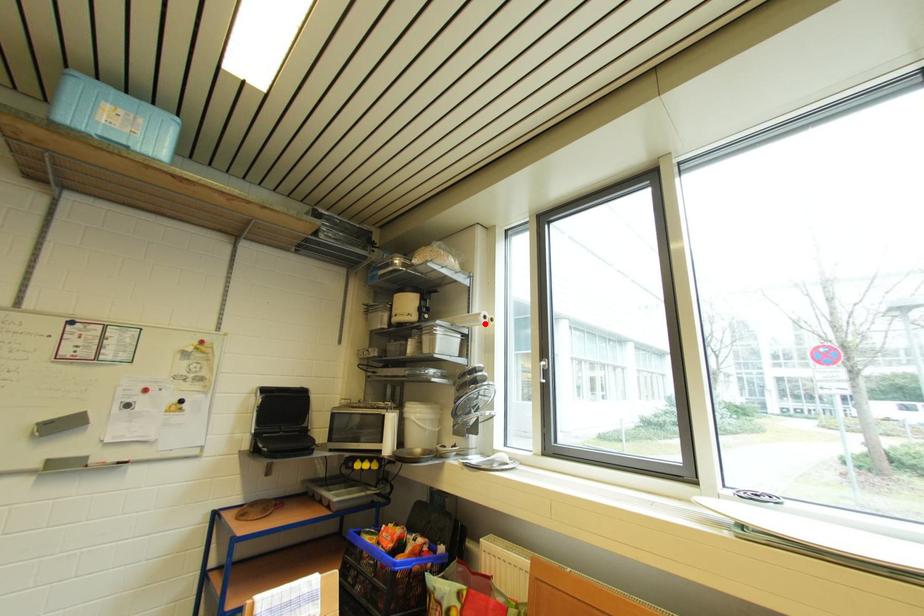
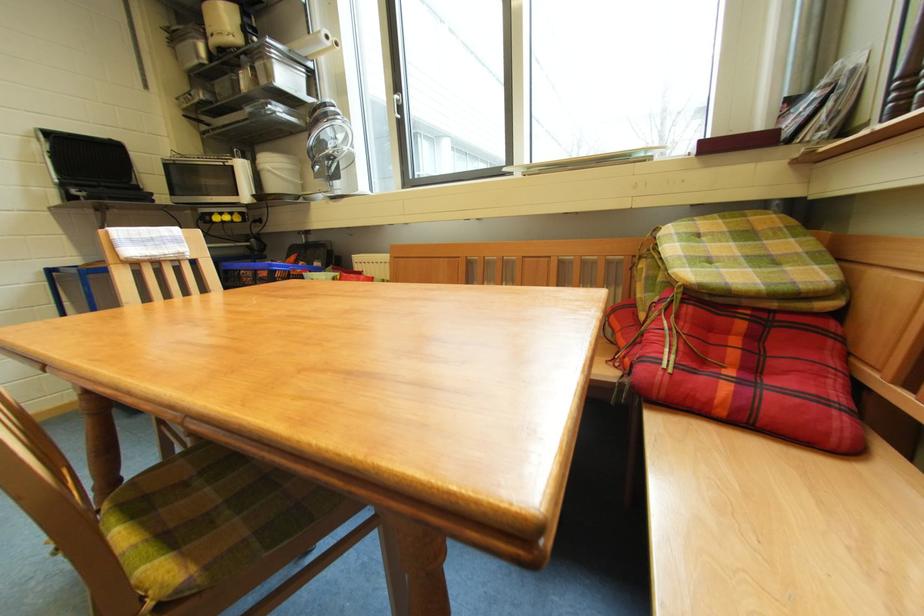
Find the pixel in the second image that matches the highlighted location in the first image.

(326, 44)